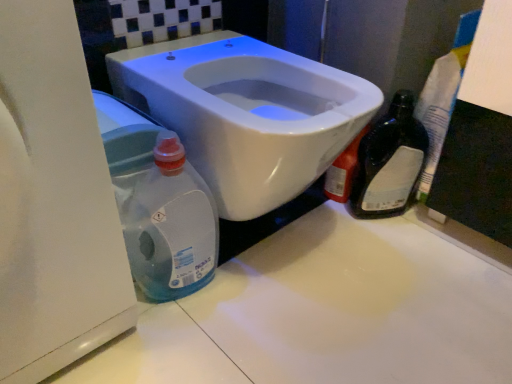
This screenshot has height=384, width=512. Find the location of `vacant space underneath white glossy toilet at center (from a real-world perspective)`. vacant space underneath white glossy toilet at center (from a real-world perspective) is located at coordinates (275, 243).